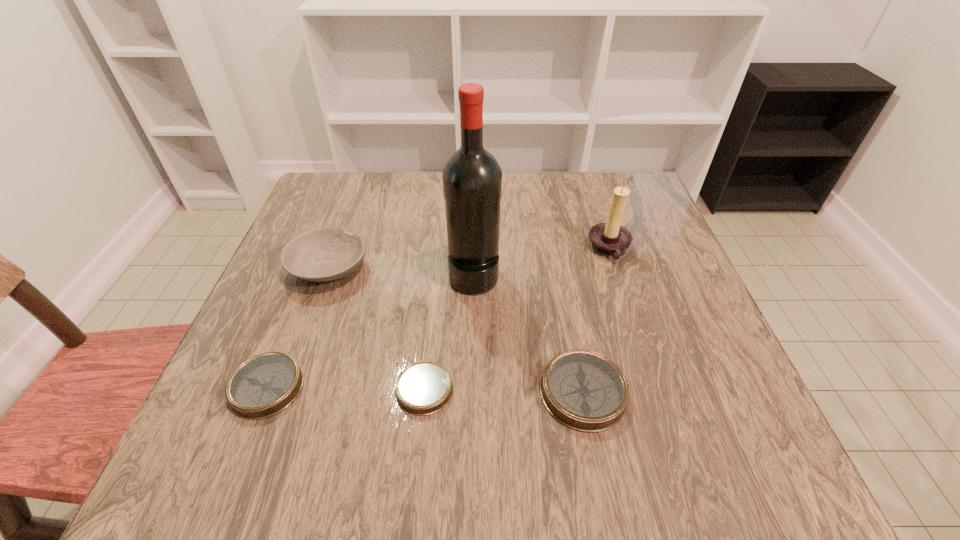
The image size is (960, 540). In order to click on blank region between the shortest object and the bowl in this screenshot , I will do `click(376, 329)`.

Find the location of a particular element. free spot between the second compass from right to left and the leftmost compass is located at coordinates (346, 388).

Locate an element on the screen. The width and height of the screenshot is (960, 540). empty location between the leftmost compass and the bowl is located at coordinates (298, 328).

Locate an element on the screen. This screenshot has height=540, width=960. unoccupied area between the rightmost compass and the wine bottle is located at coordinates (528, 334).

At what (x,y) coordinates should I click in order to perform the action: click on free space between the shortest compass and the leftmost compass. Please return your answer as a coordinate pair (x, y). The width and height of the screenshot is (960, 540). Looking at the image, I should click on (346, 388).

In order to click on vacant area that lies between the wine bottle and the rightmost object in this screenshot , I will do `click(541, 262)`.

Locate an element on the screen. The image size is (960, 540). free space that is in between the fourth shortest object and the tallest object is located at coordinates (401, 272).

Locate an element on the screen. This screenshot has height=540, width=960. vacant region between the tallest object and the bowl is located at coordinates (401, 272).

Locate which object ranks fifth in proximity to the leftmost compass. Please provide its 2D coordinates. Your answer should be formatted as a tuple, i.e. [(x, y)], where the tuple contains the x and y coordinates of a point satisfying the conditions above.

[(610, 239)]

Identify which object is located as the fifth nearest to the tallest compass. Please provide its 2D coordinates. Your answer should be formatted as a tuple, i.e. [(x, y)], where the tuple contains the x and y coordinates of a point satisfying the conditions above.

[(264, 385)]